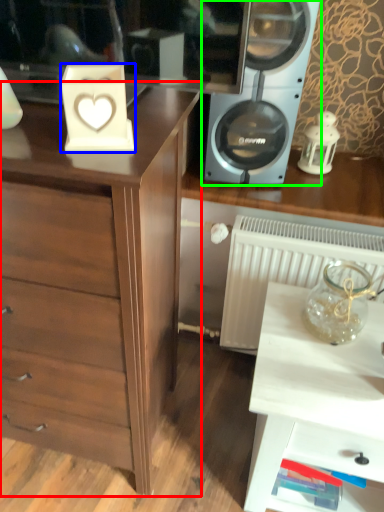
Question: Which object is positioned closest to chest of drawers (highlighted by a red box)? Select from appliance (highlighted by a blue box) and home appliance (highlighted by a green box).

Choices:
 (A) appliance
 (B) home appliance

Answer: (A)